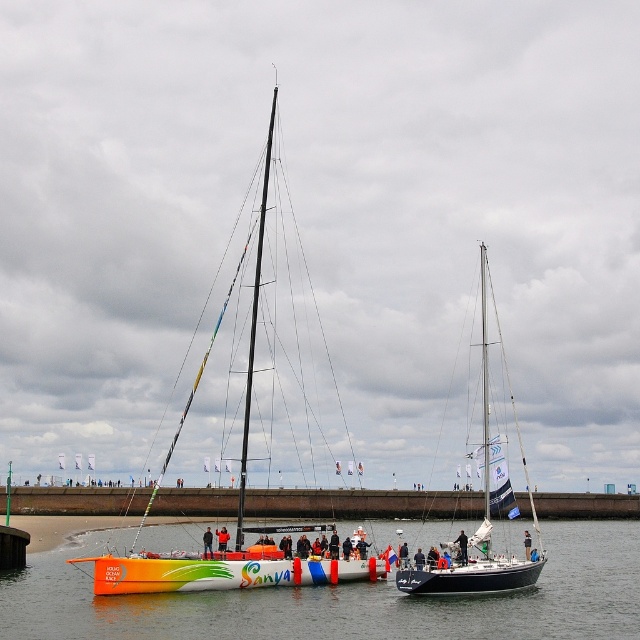
Question: Does smooth water at center have a smaller size compared to orange matte sailboat at center?

Choices:
 (A) no
 (B) yes

Answer: (B)

Question: Is black matte sailboat at center wider than orange fabric sailboat at center?

Choices:
 (A) no
 (B) yes

Answer: (B)

Question: Which of the following is the closest to the observer?

Choices:
 (A) black leather jacket at center
 (B) black matte sailboat at center
 (C) orange matte sailboat at center
 (D) orange fabric sailboat at center

Answer: (C)

Question: Which of the following is the farthest from the observer?

Choices:
 (A) orange fabric sailboat at center
 (B) smooth water at center
 (C) black matte sailboat at center
 (D) brown concrete dock at center

Answer: (D)

Question: Can you confirm if brown concrete dock at center is positioned to the right of black matte sailboat at center?

Choices:
 (A) yes
 (B) no

Answer: (B)

Question: Considering the real-world distances, which object is closest to the dark blue fabric jacket at center?

Choices:
 (A) black matte sailboat at center
 (B) black leather jacket at center

Answer: (B)